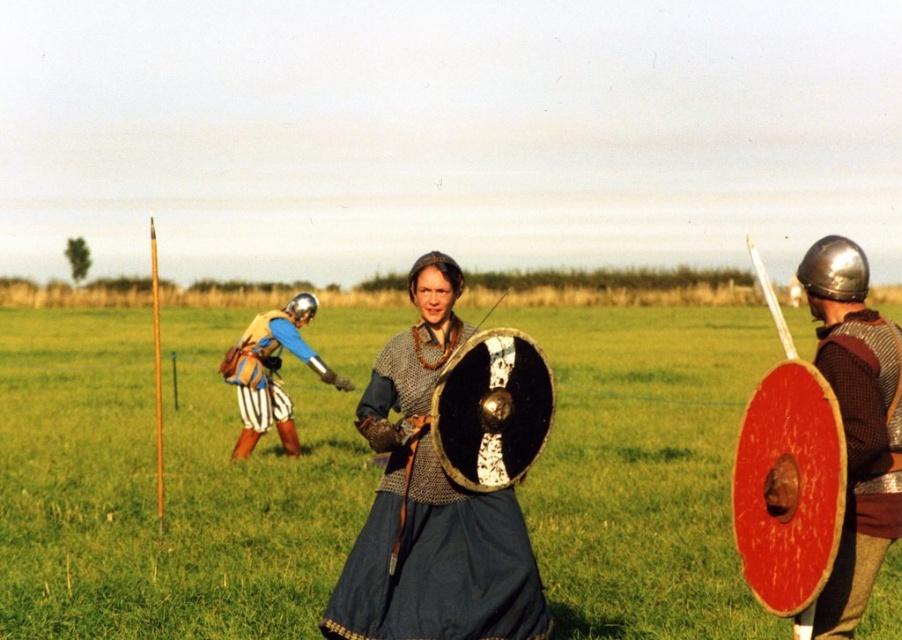
Based on the scene description, what is the significance of the point at coordinates (430, 524)?

The point at coordinates (430, 524) marks the location of the chainmail armor at center, indicating its central position in the image.

You are standing in the grassy field and want to place a small picnic basket between the green grass at center and the chainmail armor at center. Which object should you place it closer to if you want the basket to be more visible against the background?

The green grass at center has a larger width than the chainmail armor at center, so placing the picnic basket closer to the green grass at center would make it more visible against the background due to its broader expanse.